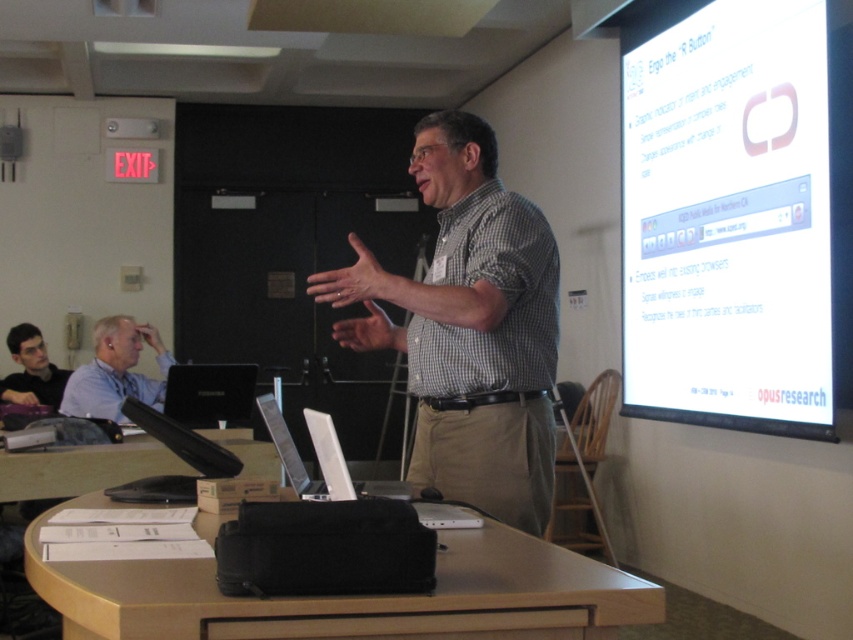
Describe the element at coordinates (730, 218) in the screenshot. The image size is (853, 640). I see `white glossy projection screen at upper right` at that location.

At what (x,y) coordinates should I click in order to perform the action: click on white glossy projection screen at upper right. Please return your answer as a coordinate pair (x, y). The height and width of the screenshot is (640, 853). Looking at the image, I should click on (730, 218).

Is point (693, 296) positioned before point (509, 209)?

No, (693, 296) is further to viewer.

This screenshot has width=853, height=640. I want to click on white glossy projection screen at upper right, so click(730, 218).

Does point (140, 333) lie in front of point (407, 497)?

That is False.

Is light blue shirt at upper left below silver metallic laptop at center?

Actually, light blue shirt at upper left is above silver metallic laptop at center.

The width and height of the screenshot is (853, 640). What are the coordinates of `light blue shirt at upper left` in the screenshot? It's located at click(x=115, y=371).

Find the location of a particular element. Image resolution: width=853 pixels, height=640 pixels. light blue shirt at upper left is located at coordinates (115, 371).

Is light blue shirt at upper left wider than dark gray shirt at lower left?

Incorrect, light blue shirt at upper left's width does not surpass dark gray shirt at lower left's.

Which is in front, point (154, 342) or point (24, 365)?

Positioned in front is point (154, 342).

Which is behind, point (103, 406) or point (18, 374)?

Point (18, 374)

Identify the location of light blue shirt at upper left. (115, 371).